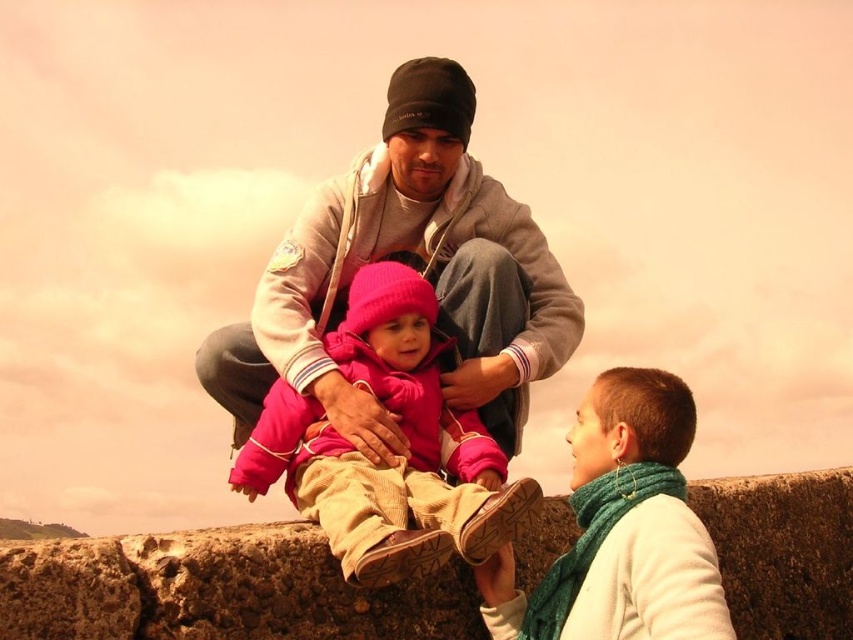
Question: Can you confirm if gray fleece jacket at center is positioned to the left of pink fleece jacket at center?

Choices:
 (A) yes
 (B) no

Answer: (B)

Question: Which point is farther from the camera taking this photo?

Choices:
 (A) (463, 224)
 (B) (622, 481)

Answer: (A)

Question: Does gray fleece jacket at center have a smaller size compared to pink fleece jacket at center?

Choices:
 (A) no
 (B) yes

Answer: (A)

Question: Which object is farther from the camera taking this photo?

Choices:
 (A) pink fleece jacket at center
 (B) green knitted scarf at lower right
 (C) gray fleece jacket at center

Answer: (C)

Question: Which object is the farthest from the pink fleece jacket at center?

Choices:
 (A) gray fleece jacket at center
 (B) green knitted scarf at lower right

Answer: (B)

Question: Can you confirm if pink fleece jacket at center is positioned to the left of green knitted scarf at lower right?

Choices:
 (A) no
 (B) yes

Answer: (B)